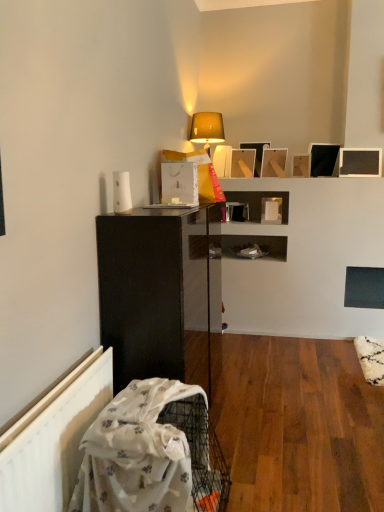
Measure the distance between point [281,160] and camera.

12.44 feet.

Describe the element at coordinates (274, 162) in the screenshot. I see `matte silver picture frame at upper center, the 3th picture frame positioned from the left` at that location.

The width and height of the screenshot is (384, 512). What do you see at coordinates (206, 129) in the screenshot?
I see `matte beige lampshade at upper center` at bounding box center [206, 129].

What is the approximate width of black matte picture frame at upper right, the fifth picture frame viewed from the left?

The width of black matte picture frame at upper right, the fifth picture frame viewed from the left, is 12.56 centimeters.

The height and width of the screenshot is (512, 384). In order to click on black matte picture frame at upper right, the fifth picture frame viewed from the left in this screenshot , I will do `click(323, 159)`.

What do you see at coordinates (256, 154) in the screenshot? The image size is (384, 512). I see `matte black picture frame at upper center, positioned as the 2th picture frame in left-to-right order` at bounding box center [256, 154].

What do you see at coordinates (243, 163) in the screenshot? I see `matte wooden picture frame at upper center, placed as the sixth picture frame when sorted from right to left` at bounding box center [243, 163].

Find the location of a particular element. The width and height of the screenshot is (384, 512). matte wooden picture frame at upper center, marked as the 1th picture frame in a left-to-right arrangement is located at coordinates (243, 163).

Where is `matte black picture frame at upper center, positioned as the fourth picture frame in left-to-right order`? The width and height of the screenshot is (384, 512). matte black picture frame at upper center, positioned as the fourth picture frame in left-to-right order is located at coordinates (301, 166).

From the image's perspective, which picture frame is the 6th one above the white plastic radiator at lower left? Please provide its 2D coordinates.

[(256, 154)]

Is matte black picture frame at upper center, positioned as the 2th picture frame in left-to-right order, far from white plastic radiator at lower left?

Yes, matte black picture frame at upper center, positioned as the 2th picture frame in left-to-right order, and white plastic radiator at lower left are quite far apart.

Which object is closer to the camera, matte black picture frame at upper center, positioned as the 2th picture frame in left-to-right order, or white plastic radiator at lower left?

white plastic radiator at lower left is more forward.

Does matte wooden picture frame at upper center, marked as the 1th picture frame in a left-to-right arrangement, have a smaller size compared to matte black picture frame at upper center, marked as the 3th picture frame in a right-to-left arrangement?

Incorrect, matte wooden picture frame at upper center, marked as the 1th picture frame in a left-to-right arrangement, is not smaller in size than matte black picture frame at upper center, marked as the 3th picture frame in a right-to-left arrangement.

Considering the sizes of objects matte wooden picture frame at upper center, placed as the sixth picture frame when sorted from right to left, and matte black picture frame at upper center, marked as the 3th picture frame in a right-to-left arrangement, in the image provided, who is taller, matte wooden picture frame at upper center, placed as the sixth picture frame when sorted from right to left, or matte black picture frame at upper center, marked as the 3th picture frame in a right-to-left arrangement,?

Standing taller between the two is matte wooden picture frame at upper center, placed as the sixth picture frame when sorted from right to left.

Is matte black picture frame at upper center, marked as the 3th picture frame in a right-to-left arrangement, inside matte wooden picture frame at upper center, placed as the sixth picture frame when sorted from right to left?

No.

From a real-world perspective, is matte wooden picture frame at upper center, marked as the 1th picture frame in a left-to-right arrangement, under matte black picture frame at upper center, marked as the 3th picture frame in a right-to-left arrangement?

No, from a real-world perspective, matte wooden picture frame at upper center, marked as the 1th picture frame in a left-to-right arrangement, is not under matte black picture frame at upper center, marked as the 3th picture frame in a right-to-left arrangement.

Between matte black picture frame at upper right, which ranks as the 6th picture frame in left-to-right order, and black matte picture frame at upper right, the fifth picture frame viewed from the left, which one has less height?

matte black picture frame at upper right, which ranks as the 6th picture frame in left-to-right order, is shorter.

Considering the relative sizes of matte black picture frame at upper right, the first picture frame when ordered from right to left, and black matte picture frame at upper right, which is the second picture frame in right-to-left order, in the image provided, is matte black picture frame at upper right, the first picture frame when ordered from right to left, smaller than black matte picture frame at upper right, which is the second picture frame in right-to-left order,?

Yes.

Would you say matte black picture frame at upper right, which ranks as the 6th picture frame in left-to-right order, is to the left or to the right of black matte picture frame at upper right, which is the second picture frame in right-to-left order, in the picture?

Clearly, matte black picture frame at upper right, which ranks as the 6th picture frame in left-to-right order, is on the right of black matte picture frame at upper right, which is the second picture frame in right-to-left order, in the image.

Measure the distance from matte black picture frame at upper right, the first picture frame when ordered from right to left, to black matte picture frame at upper right, the fifth picture frame viewed from the left.

matte black picture frame at upper right, the first picture frame when ordered from right to left, and black matte picture frame at upper right, the fifth picture frame viewed from the left, are 7.95 inches apart.

Is point (232, 165) more distant than point (275, 157)?

Yes, it is.

You are a GUI agent. You are given a task and a screenshot of the screen. Output one action in this format:
    pyautogui.click(x=<x>, y=<y>)
    Task: Click on the 1st picture frame located above the matte wooden picture frame at upper center, placed as the sixth picture frame when sorted from right to left (from a real-world perspective)
    This screenshot has height=512, width=384.
    Given the screenshot: What is the action you would take?
    [274, 162]

Does matte wooden picture frame at upper center, placed as the sixth picture frame when sorted from right to left, appear on the left side of matte silver picture frame at upper center, the 3th picture frame positioned from the left?

Correct, you'll find matte wooden picture frame at upper center, placed as the sixth picture frame when sorted from right to left, to the left of matte silver picture frame at upper center, the 3th picture frame positioned from the left.

Does matte wooden picture frame at upper center, marked as the 1th picture frame in a left-to-right arrangement, have a smaller size compared to matte silver picture frame at upper center, positioned as the fourth picture frame in right-to-left order?

Correct, matte wooden picture frame at upper center, marked as the 1th picture frame in a left-to-right arrangement, occupies less space than matte silver picture frame at upper center, positioned as the fourth picture frame in right-to-left order.

From the image's perspective, who appears lower, white plastic radiator at lower left or matte black picture frame at upper right, the first picture frame when ordered from right to left?

From the image's view, white plastic radiator at lower left is below.

Could you measure the distance between white plastic radiator at lower left and matte black picture frame at upper right, the first picture frame when ordered from right to left?

white plastic radiator at lower left and matte black picture frame at upper right, the first picture frame when ordered from right to left, are 3.01 meters apart.

Is white plastic radiator at lower left at the left side of matte black picture frame at upper right, which ranks as the 6th picture frame in left-to-right order?

Correct, you'll find white plastic radiator at lower left to the left of matte black picture frame at upper right, which ranks as the 6th picture frame in left-to-right order.

Is white plastic radiator at lower left thinner than matte black picture frame at upper right, the first picture frame when ordered from right to left?

Indeed, white plastic radiator at lower left has a lesser width compared to matte black picture frame at upper right, the first picture frame when ordered from right to left.

Considering the relative sizes of matte black picture frame at upper center, marked as the 3th picture frame in a right-to-left arrangement, and matte silver picture frame at upper center, the 3th picture frame positioned from the left, in the image provided, is matte black picture frame at upper center, marked as the 3th picture frame in a right-to-left arrangement, taller than matte silver picture frame at upper center, the 3th picture frame positioned from the left,?

In fact, matte black picture frame at upper center, marked as the 3th picture frame in a right-to-left arrangement, may be shorter than matte silver picture frame at upper center, the 3th picture frame positioned from the left.

Consider the image. Is matte black picture frame at upper center, positioned as the fourth picture frame in left-to-right order, facing towards matte silver picture frame at upper center, the 3th picture frame positioned from the left?

No, matte black picture frame at upper center, positioned as the fourth picture frame in left-to-right order, does not turn towards matte silver picture frame at upper center, the 3th picture frame positioned from the left.

Is matte black picture frame at upper center, positioned as the fourth picture frame in left-to-right order, positioned before matte silver picture frame at upper center, positioned as the fourth picture frame in right-to-left order?

That is True.

Is white fabric at lower left turned away from matte black picture frame at upper center, positioned as the fourth picture frame in left-to-right order?

white fabric at lower left does not have its back to matte black picture frame at upper center, positioned as the fourth picture frame in left-to-right order.

Can you see white fabric at lower left touching matte black picture frame at upper center, positioned as the fourth picture frame in left-to-right order?

There is a gap between white fabric at lower left and matte black picture frame at upper center, positioned as the fourth picture frame in left-to-right order.

Is white fabric at lower left in front of or behind matte black picture frame at upper center, positioned as the fourth picture frame in left-to-right order, in the image?

Visually, white fabric at lower left is located in front of matte black picture frame at upper center, positioned as the fourth picture frame in left-to-right order.

This screenshot has width=384, height=512. What are the coordinates of `the 6th picture frame above the white plastic radiator at lower left (from the image's perspective)` in the screenshot? It's located at (256, 154).

This screenshot has height=512, width=384. I want to click on the 3rd picture frame behind the matte black picture frame at upper center, positioned as the fourth picture frame in left-to-right order, so click(x=243, y=163).

When comparing their distances from matte black cabinet at left, does white plastic radiator at lower left or white fabric at lower left seem further?

white plastic radiator at lower left lies further to matte black cabinet at left than the other object.

Which object lies nearer to the anchor point black matte picture frame at upper right, which is the second picture frame in right-to-left order, matte silver picture frame at upper center, positioned as the fourth picture frame in right-to-left order, or matte black picture frame at upper center, the fifth picture frame in the right-to-left sequence?

matte silver picture frame at upper center, positioned as the fourth picture frame in right-to-left order, is positioned closer to the anchor black matte picture frame at upper right, which is the second picture frame in right-to-left order.

Looking at the image, which one is located further to white fabric at lower left, black matte picture frame at upper right, the fifth picture frame viewed from the left, or matte beige lampshade at upper center?

black matte picture frame at upper right, the fifth picture frame viewed from the left.

Which object lies nearer to the anchor point white plastic radiator at lower left, white fabric at lower left or matte wooden picture frame at upper center, placed as the sixth picture frame when sorted from right to left?

white fabric at lower left lies closer to white plastic radiator at lower left than the other object.

Based on their spatial positions, is white plastic radiator at lower left or black matte picture frame at upper right, the fifth picture frame viewed from the left, further from matte wooden picture frame at upper center, placed as the sixth picture frame when sorted from right to left?

white plastic radiator at lower left lies further to matte wooden picture frame at upper center, placed as the sixth picture frame when sorted from right to left, than the other object.

From the image, which object appears to be farther from matte black picture frame at upper center, positioned as the 2th picture frame in left-to-right order, matte black picture frame at upper center, marked as the 3th picture frame in a right-to-left arrangement, or matte beige lampshade at upper center?

The object further to matte black picture frame at upper center, positioned as the 2th picture frame in left-to-right order, is matte beige lampshade at upper center.

Considering their positions, is white fabric at lower left positioned further to matte wooden picture frame at upper center, placed as the sixth picture frame when sorted from right to left, than black matte picture frame at upper right, the fifth picture frame viewed from the left?

white fabric at lower left.

Based on their spatial positions, is matte wooden picture frame at upper center, placed as the sixth picture frame when sorted from right to left, or matte beige lampshade at upper center closer to matte black picture frame at upper center, the fifth picture frame in the right-to-left sequence?

Among the two, matte wooden picture frame at upper center, placed as the sixth picture frame when sorted from right to left, is located nearer to matte black picture frame at upper center, the fifth picture frame in the right-to-left sequence.

Find the location of a particular element. cabinetry between white plastic radiator at lower left and matte black picture frame at upper center, marked as the 3th picture frame in a right-to-left arrangement, in the front-back direction is located at coordinates (160, 294).

You are a GUI agent. You are given a task and a screenshot of the screen. Output one action in this format:
    pyautogui.click(x=<x>, y=<y>)
    Task: Click on the cabinetry positioned between white fabric at lower left and matte black picture frame at upper center, marked as the 3th picture frame in a right-to-left arrangement, from near to far
    
    Given the screenshot: What is the action you would take?
    pyautogui.click(x=160, y=294)

Identify the location of blanket positioned between white plastic radiator at lower left and matte beige lampshade at upper center from near to far. This screenshot has height=512, width=384. (143, 449).

What are the coordinates of `lamp between white fabric at lower left and black matte picture frame at upper right, the fifth picture frame viewed from the left, along the z-axis` in the screenshot? It's located at (206, 129).